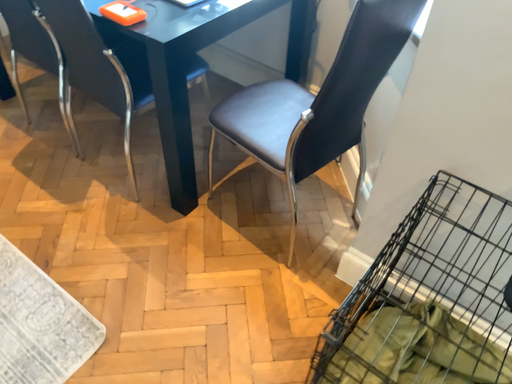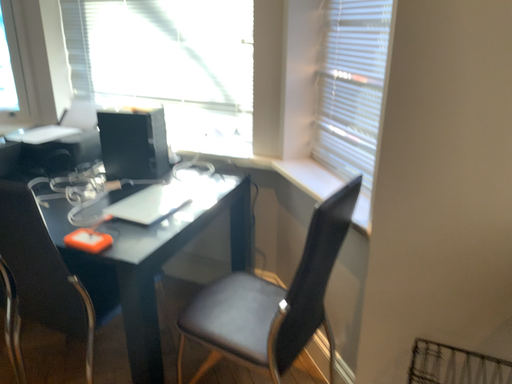
Question: Which way did the camera rotate in the video?

Choices:
 (A) rotated right
 (B) rotated left

Answer: (A)